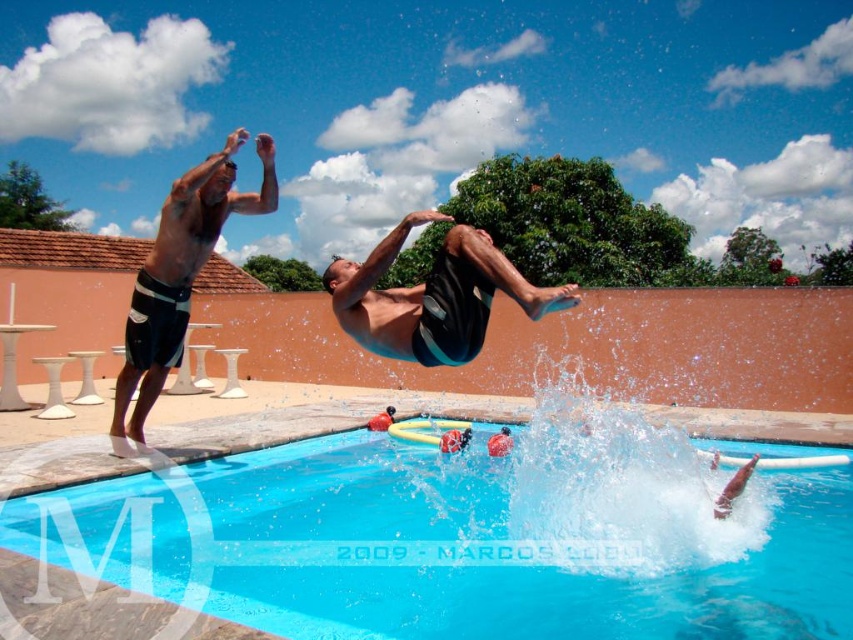
Does black matte shorts at center appear on the left side of black matte shorts at left?

In fact, black matte shorts at center is to the right of black matte shorts at left.

Does black matte shorts at center have a greater width compared to black matte shorts at left?

Yes.

Is point (323, 275) positioned after point (136, 381)?

No, (323, 275) is closer to viewer.

You are a GUI agent. You are given a task and a screenshot of the screen. Output one action in this format:
    pyautogui.click(x=<x>, y=<y>)
    Task: Click on the black matte shorts at center
    This screenshot has width=853, height=640.
    Given the screenshot: What is the action you would take?
    pyautogui.click(x=433, y=296)

Which is behind, point (604, 573) or point (151, 252)?

Point (151, 252)

Is blue smooth water at center thinner than black matte shorts at left?

No.

I want to click on blue smooth water at center, so click(469, 540).

Is point (547, 522) positioned behind point (380, 253)?

That is True.

Is blue smooth water at center in front of black matte shorts at center?

No.

Where is `blue smooth water at center`? The image size is (853, 640). blue smooth water at center is located at coordinates (469, 540).

Find the location of `blue smooth water at center`. blue smooth water at center is located at coordinates (469, 540).